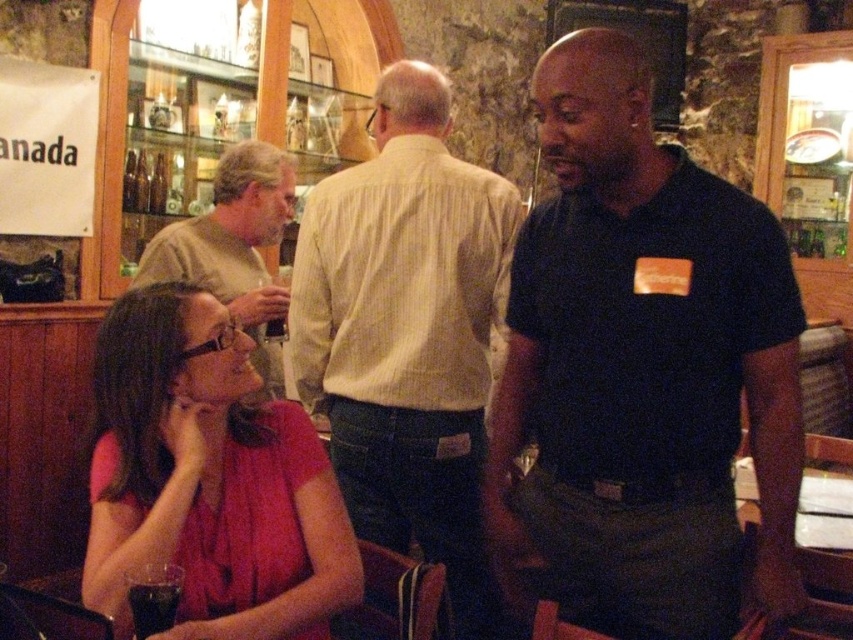
Does light brown shirt at upper left appear on the right side of dark brown liquid at lower left?

No, light brown shirt at upper left is not to the right of dark brown liquid at lower left.

Which of these two, light brown shirt at upper left or dark brown liquid at lower left, stands shorter?

dark brown liquid at lower left

At what (x,y) coordinates should I click in order to perform the action: click on light brown shirt at upper left. Please return your answer as a coordinate pair (x, y). The width and height of the screenshot is (853, 640). Looking at the image, I should click on (234, 246).

Locate an element on the screen. This screenshot has height=640, width=853. light brown shirt at upper left is located at coordinates (234, 246).

Which of these two, black cotton shirt at center or matte pink blouse at lower left, stands shorter?

matte pink blouse at lower left

Who is positioned more to the left, black cotton shirt at center or matte pink blouse at lower left?

From the viewer's perspective, matte pink blouse at lower left appears more on the left side.

Where is `black cotton shirt at center`? black cotton shirt at center is located at coordinates (641, 369).

Does black cotton shirt at center appear on the right side of light brown shirt at upper left?

Indeed, black cotton shirt at center is positioned on the right side of light brown shirt at upper left.

Can you confirm if black cotton shirt at center is positioned to the left of light brown shirt at upper left?

Incorrect, black cotton shirt at center is not on the left side of light brown shirt at upper left.

Does point (729, 392) come farther from viewer compared to point (260, 353)?

No, (729, 392) is in front of (260, 353).

At what (x,y) coordinates should I click in order to perform the action: click on black cotton shirt at center. Please return your answer as a coordinate pair (x, y). This screenshot has height=640, width=853. Looking at the image, I should click on (641, 369).